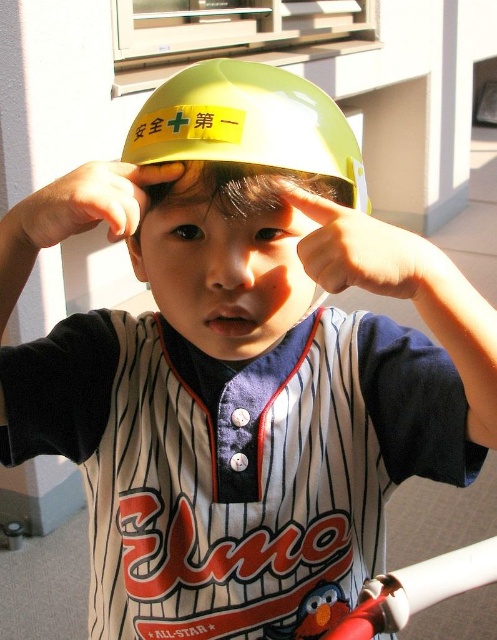
You are a safety inspector checking the scene. The matte yellow finger at center and the matte yellow finger at upper center are both part of the child. Which finger is closer to the camera?

The matte yellow finger at upper center is closer to the camera because it is positioned above the matte yellow finger at center, which is beneath it.

You are a delivery robot that needs to deliver a package to the point marked at coordinate point (288, 188). The package is 18 inches wide. Can you fit the package through the space between the child and the window? Please explain your reasoning.

The distance between the point at coordinate point (288, 188) and the viewer is 17.30 inches. Since the package is 18 inches wide, it is slightly wider than the available space, so the package cannot fit through the space between the child and the window.